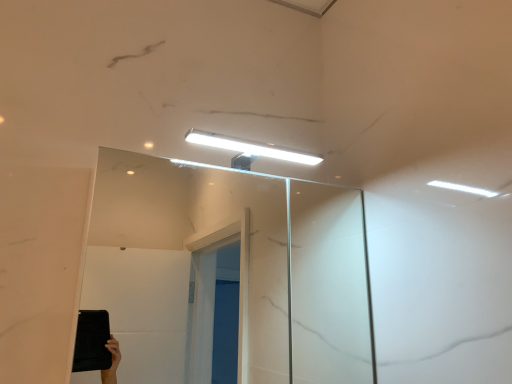
The width and height of the screenshot is (512, 384). What do you see at coordinates (296, 277) in the screenshot?
I see `white glossy mirror at upper center` at bounding box center [296, 277].

The height and width of the screenshot is (384, 512). In order to click on white glossy mirror at upper center in this screenshot , I will do `click(296, 277)`.

Image resolution: width=512 pixels, height=384 pixels. What are the coordinates of `white glossy mirror at upper center` in the screenshot? It's located at (296, 277).